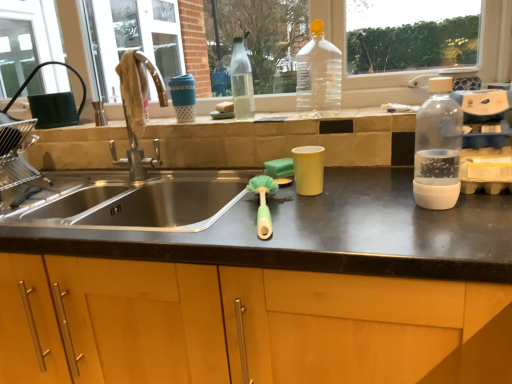
I want to click on vacant area that lies in front of green sponge at center, so [293, 193].